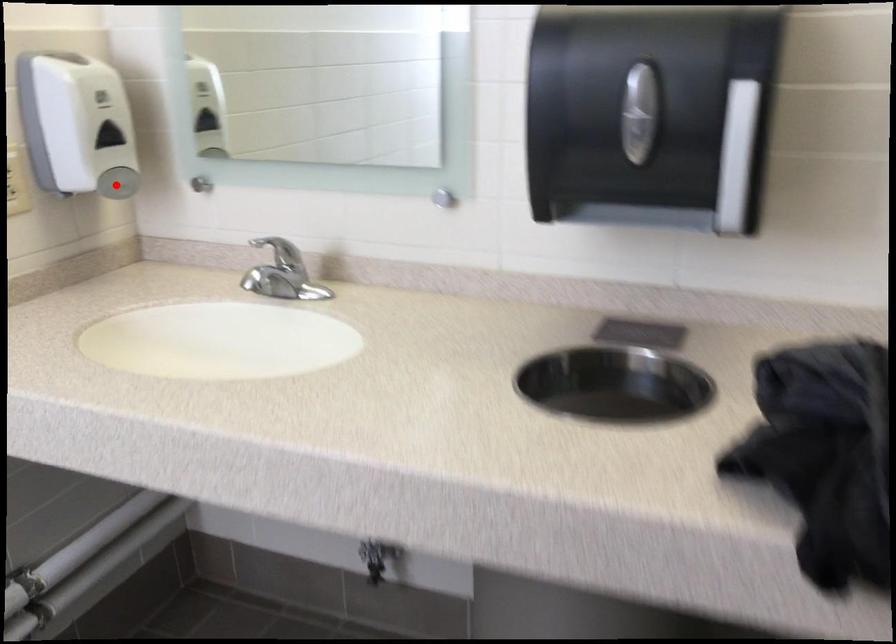
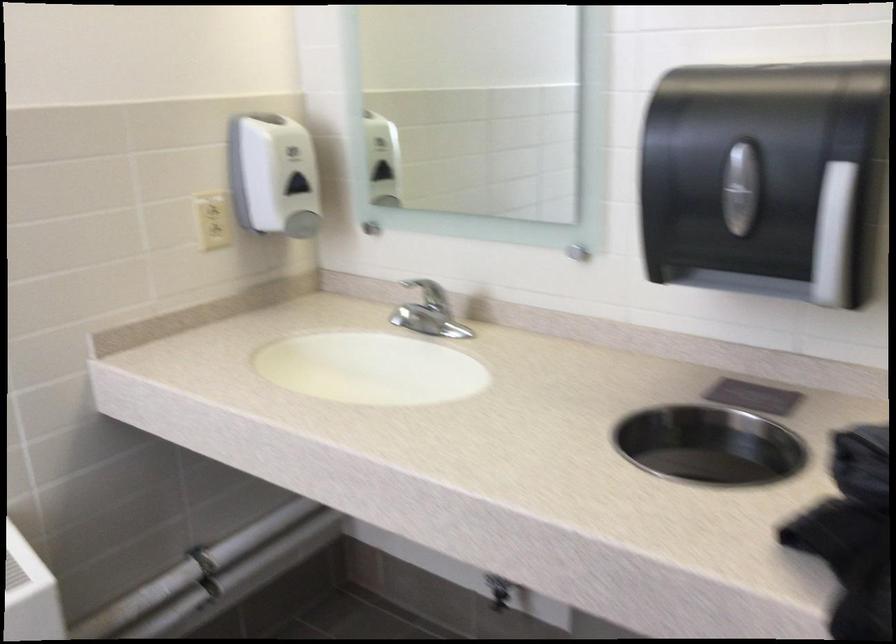
Find the pixel in the second image that matches the highlighted location in the first image.

(302, 223)